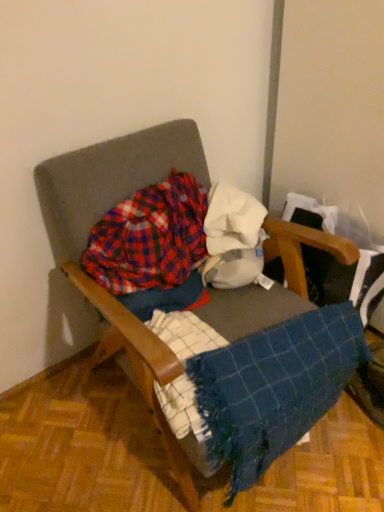
Question: Considering the relative sizes of wooden armchair at center and plaid fabric at center in the image provided, is wooden armchair at center taller than plaid fabric at center?

Choices:
 (A) no
 (B) yes

Answer: (B)

Question: Can you confirm if wooden armchair at center is wider than plaid fabric at center?

Choices:
 (A) no
 (B) yes

Answer: (B)

Question: Considering the relative positions of wooden armchair at center and plaid fabric at center in the image provided, is wooden armchair at center to the left of plaid fabric at center from the viewer's perspective?

Choices:
 (A) no
 (B) yes

Answer: (A)

Question: Is the surface of wooden armchair at center in direct contact with plaid fabric at center?

Choices:
 (A) no
 (B) yes

Answer: (A)

Question: Considering the relative positions of wooden armchair at center and plaid fabric at center in the image provided, is wooden armchair at center to the right of plaid fabric at center from the viewer's perspective?

Choices:
 (A) yes
 (B) no

Answer: (A)

Question: Is point (210, 421) closer or farther from the camera than point (117, 166)?

Choices:
 (A) closer
 (B) farther

Answer: (A)

Question: From the image's perspective, is blue woven blanket at lower right above or below wooden armchair at center?

Choices:
 (A) below
 (B) above

Answer: (A)

Question: Based on their positions, is blue woven blanket at lower right located to the left or right of wooden armchair at center?

Choices:
 (A) right
 (B) left

Answer: (A)

Question: Would you say blue woven blanket at lower right is inside or outside wooden armchair at center?

Choices:
 (A) inside
 (B) outside

Answer: (A)

Question: Looking at their shapes, would you say plaid fabric at center is wider or thinner than blue woven blanket at lower right?

Choices:
 (A) thin
 (B) wide

Answer: (A)

Question: In the image, is plaid fabric at center on the left side or the right side of blue woven blanket at lower right?

Choices:
 (A) right
 (B) left

Answer: (B)

Question: From the image's perspective, relative to blue woven blanket at lower right, is plaid fabric at center above or below?

Choices:
 (A) below
 (B) above

Answer: (B)

Question: Considering their positions, is plaid fabric at center located in front of or behind blue woven blanket at lower right?

Choices:
 (A) behind
 (B) front

Answer: (A)

Question: Would you say wooden armchair at center is inside or outside blue woven blanket at lower right?

Choices:
 (A) inside
 (B) outside

Answer: (B)

Question: Looking at the image, does wooden armchair at center seem bigger or smaller compared to blue woven blanket at lower right?

Choices:
 (A) small
 (B) big

Answer: (B)